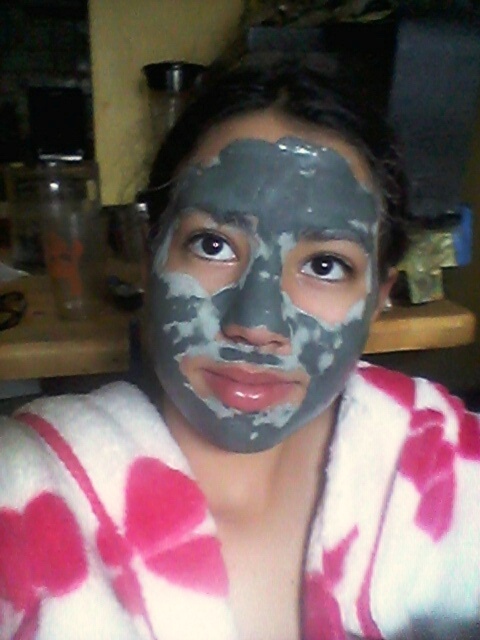
Is white fuzzy bathrobe at center bigger than gray clay mask at center?

Yes, white fuzzy bathrobe at center is bigger than gray clay mask at center.

Is white fuzzy bathrobe at center wider than gray clay mask at center?

Correct, the width of white fuzzy bathrobe at center exceeds that of gray clay mask at center.

Image resolution: width=480 pixels, height=640 pixels. I want to click on white fuzzy bathrobe at center, so click(x=105, y=525).